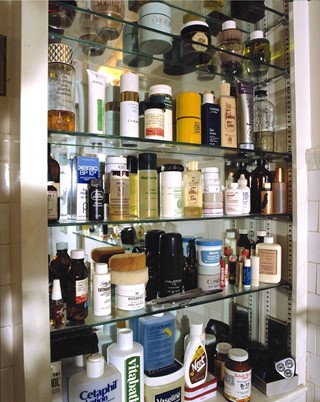
The width and height of the screenshot is (320, 402). Identify the location of cabinet. (29, 262).